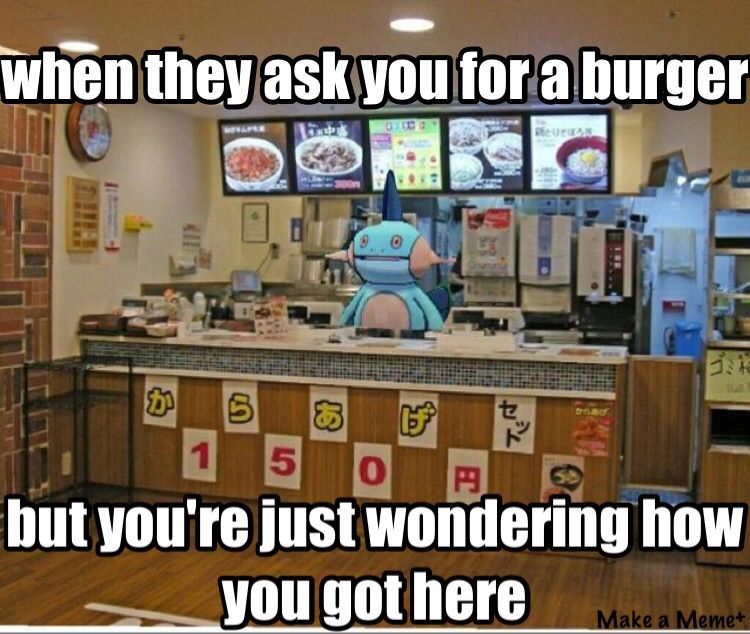
Where is `cash register`? Image resolution: width=750 pixels, height=634 pixels. cash register is located at coordinates (486, 321).